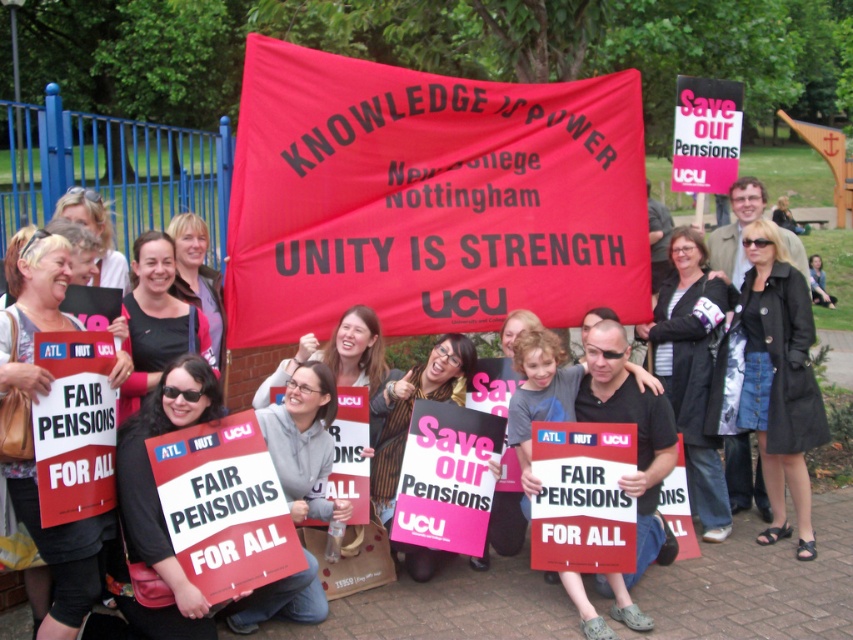
Is red fabric banner at center above matte black jacket at center?

Indeed, red fabric banner at center is positioned over matte black jacket at center.

Does red fabric banner at center appear under matte black jacket at center?

Actually, red fabric banner at center is above matte black jacket at center.

Does point (287, 308) lie behind point (815, 634)?

That is True.

Locate an element on the screen. red fabric banner at center is located at coordinates (428, 196).